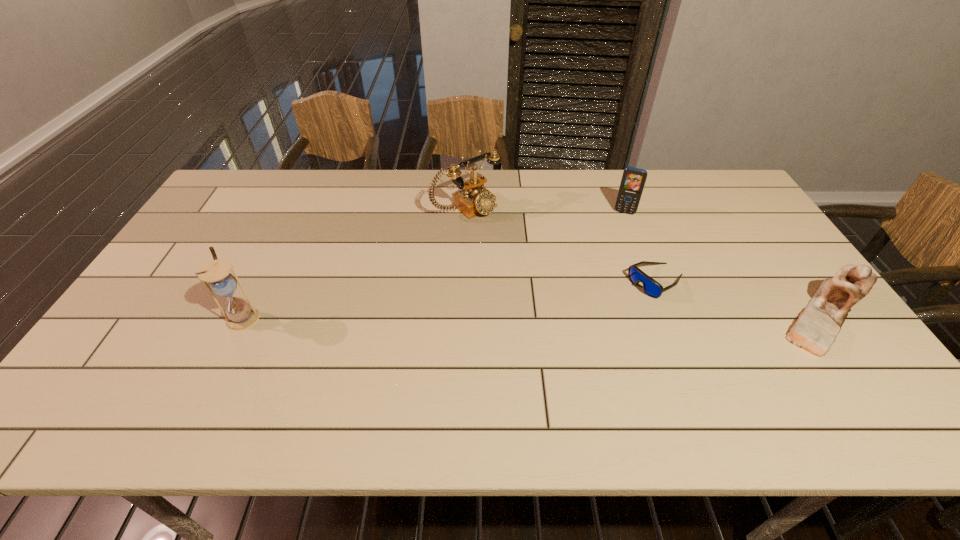
The width and height of the screenshot is (960, 540). Identify the location of free space located 0.260m on the screen of the cellular telephone. (609, 266).

This screenshot has width=960, height=540. I want to click on vacant space situated on the screen of the cellular telephone, so click(614, 244).

Where is `vacant space located 0.060m on the front-facing side of the sunglasses`? This screenshot has width=960, height=540. vacant space located 0.060m on the front-facing side of the sunglasses is located at coordinates (621, 302).

The height and width of the screenshot is (540, 960). What are the coordinates of `free region located 0.050m on the front-facing side of the sunglasses` in the screenshot? It's located at (624, 300).

This screenshot has height=540, width=960. In order to click on free space located 0.330m on the front-facing side of the sunglasses in this screenshot , I will do `click(544, 349)`.

Locate an element on the screen. Image resolution: width=960 pixels, height=540 pixels. free space located 0.300m on the dial number of the telephone is located at coordinates (549, 272).

Find the location of `free space located 0.270m on the dial number of the telephone`. free space located 0.270m on the dial number of the telephone is located at coordinates (541, 266).

Find the location of a particular element. This screenshot has height=540, width=960. vacant space located 0.400m on the dial number of the telephone is located at coordinates (573, 292).

I want to click on cellular telephone positioned at the far edge, so click(x=633, y=180).

At what (x,y) coordinates should I click in order to perform the action: click on telephone located at the far edge. Please return your answer as a coordinate pair (x, y). Image resolution: width=960 pixels, height=540 pixels. Looking at the image, I should click on (475, 199).